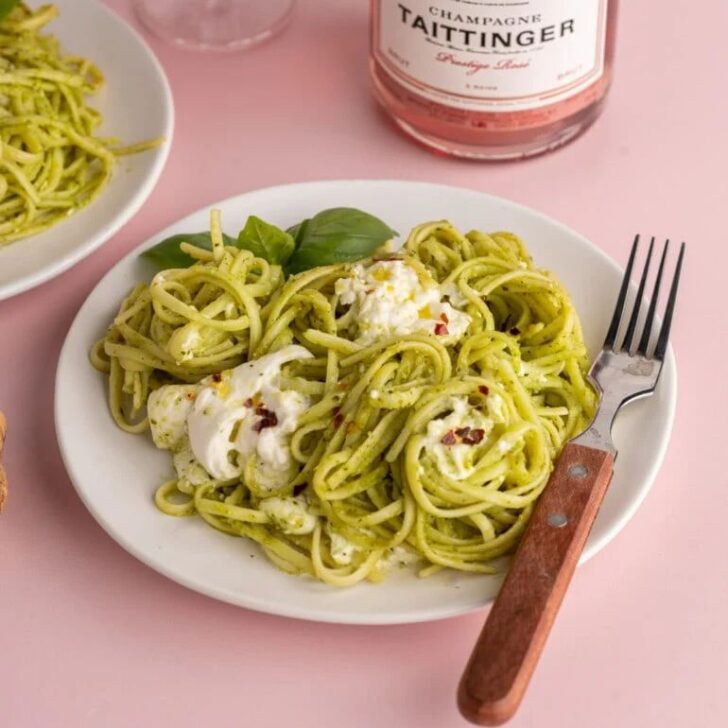
Where is `glass`? Image resolution: width=728 pixels, height=728 pixels. glass is located at coordinates (236, 19).